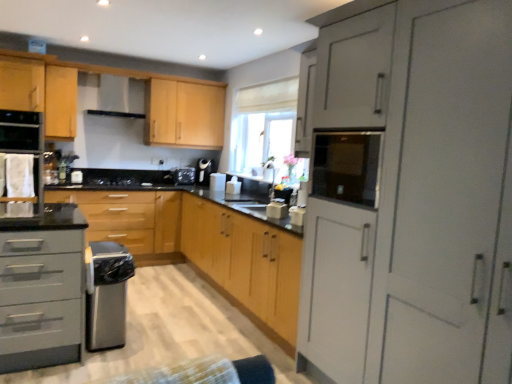
Question: Which direction should I rotate to look at white glossy paper towel dispenser at center, acting as the 3th appliance starting from the right?

Choices:
 (A) left
 (B) right

Answer: (A)

Question: Is white glossy toaster at center shorter than matte gray cabinet at right, marked as the 1th cabinetry in a front-to-back arrangement?

Choices:
 (A) no
 (B) yes

Answer: (B)

Question: Is white glossy toaster at center positioned beyond the bounds of matte gray cabinet at right, which is the fifth cabinetry from back to front?

Choices:
 (A) yes
 (B) no

Answer: (A)

Question: Is white glossy toaster at center bigger than matte gray cabinet at right, marked as the 1th cabinetry in a front-to-back arrangement?

Choices:
 (A) no
 (B) yes

Answer: (A)

Question: From the image's perspective, is white glossy toaster at center located beneath matte gray cabinet at right, which is the fifth cabinetry from back to front?

Choices:
 (A) no
 (B) yes

Answer: (A)

Question: Does white glossy toaster at center have a lesser width compared to matte gray cabinet at right, which is the fifth cabinetry from back to front?

Choices:
 (A) no
 (B) yes

Answer: (B)

Question: Is the position of white glossy toaster at center less distant than that of matte gray cabinet at right, which is the fifth cabinetry from back to front?

Choices:
 (A) yes
 (B) no

Answer: (B)

Question: Is light wood cabinet at upper left, the 1th cabinetry when ordered from back to front, further to the viewer compared to white fabric oven at left?

Choices:
 (A) yes
 (B) no

Answer: (A)

Question: Is light wood cabinet at upper left, the 1th cabinetry when ordered from back to front, positioned far away from white fabric oven at left?

Choices:
 (A) yes
 (B) no

Answer: (B)

Question: From the image's perspective, is light wood cabinet at upper left, the 5th cabinetry viewed from the front, on white fabric oven at left?

Choices:
 (A) yes
 (B) no

Answer: (A)

Question: From a real-world perspective, is light wood cabinet at upper left, the 5th cabinetry viewed from the front, positioned over white fabric oven at left based on gravity?

Choices:
 (A) no
 (B) yes

Answer: (B)

Question: Is the depth of light wood cabinet at upper left, the 1th cabinetry when ordered from back to front, less than that of white fabric oven at left?

Choices:
 (A) yes
 (B) no

Answer: (B)

Question: Considering the relative sizes of light wood cabinet at upper left, the 5th cabinetry viewed from the front, and white fabric oven at left in the image provided, is light wood cabinet at upper left, the 5th cabinetry viewed from the front, smaller than white fabric oven at left?

Choices:
 (A) no
 (B) yes

Answer: (A)

Question: From a real-world perspective, does white glossy toaster at center stand above white fabric oven at left?

Choices:
 (A) no
 (B) yes

Answer: (A)